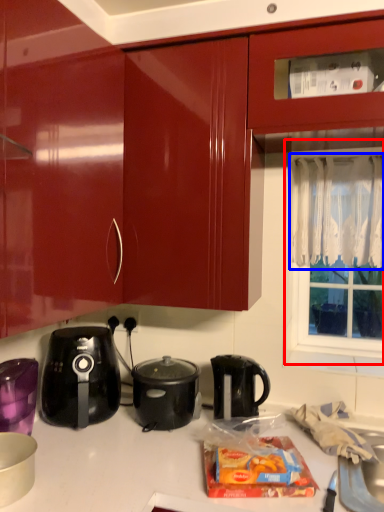
Question: Which object is further to the camera taking this photo, window screen (highlighted by a red box) or curtain (highlighted by a blue box)?

Choices:
 (A) window screen
 (B) curtain

Answer: (A)